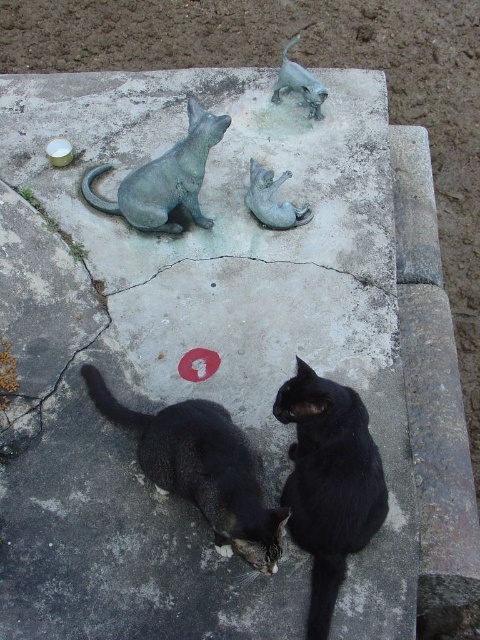
You are a photographer trying to capture a clear shot of both the shiny black cat at lower center and the bronze cat at upper center. Since you want both subjects in focus, you need to know which one is closer to you. Can you determine which cat is nearer?

The shiny black cat at lower center is closer to the viewer than the bronze cat at upper center, so you should focus on the shiny black cat at lower center first to ensure both are in focus.

You are a photographer trying to capture a photo of the bronze cat at upper center without including the shiny black cat at lower center in the frame. Based on their positions, is this possible?

Yes, since the shiny black cat at lower center is to the left of the bronze cat at upper center, you can adjust your camera angle to exclude the shiny black cat at lower center by framing the shot to the right side of the bronze cat at upper center.